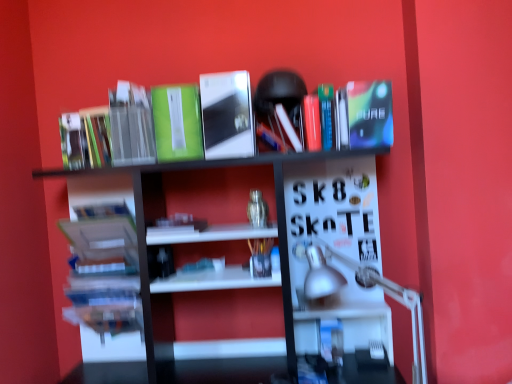
Question: Visually, is hardcover books at left, which is the 4th book in right-to-left order, positioned to the left or to the right of matte green book at upper left, which is counted as the 5th book, starting from the right?

Choices:
 (A) right
 (B) left

Answer: (A)

Question: Based on their sizes in the image, would you say hardcover books at left, which is the 4th book in right-to-left order, is bigger or smaller than matte green book at upper left, which is counted as the 5th book, starting from the right?

Choices:
 (A) small
 (B) big

Answer: (B)

Question: Considering the real-world distances, which object is farthest from the white glossy bookshelf at upper center?

Choices:
 (A) green matte book at upper left, which appears as the 1th paperback book when viewed from the left
 (B) silver metallic table lamp at lower right
 (C) hardcover books at left, positioned as the 2th book in left-to-right order
 (D) shiny blue paperback at upper right, the fourth paperback book in the left-to-right sequence
 (E) green matte book at upper center, which ranks as the 2th paperback book in left-to-right order

Answer: (B)

Question: Estimate the real-world distances between objects in this image. Which object is farther from the white matte book at center, which appears as the 2th book when viewed from the right?

Choices:
 (A) matte green book at upper left, the first book when ordered from left to right
 (B) green matte book at upper left, which ranks as the third book in left-to-right order
 (C) white glossy bookshelf at upper center
 (D) green matte book at upper center, the third paperback book from the right
 (E) hardcover books at left, which is the 4th book in right-to-left order

Answer: (A)